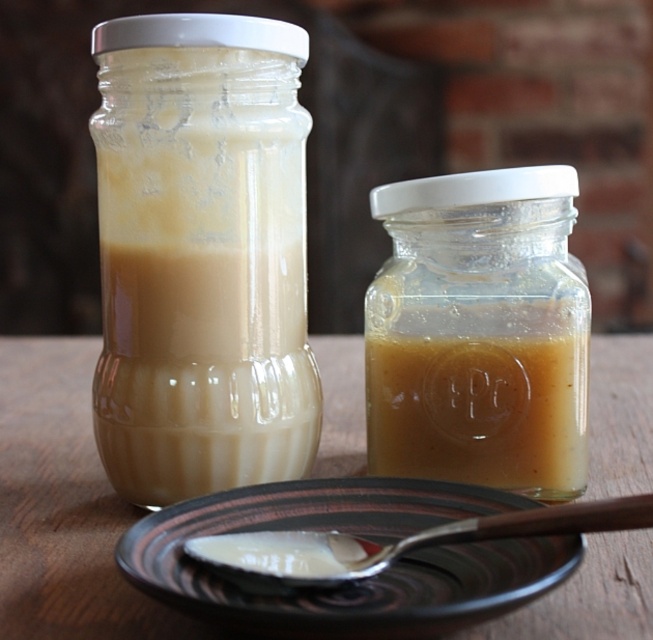
You are a chef preparing a dish and need to place the translucent glass jar at center onto the wooden table at center. Can you safely place it without moving the jar or the table?

The translucent glass jar at center and wooden table at center are 20.48 centimeters apart, so you can safely place the jar on the table without needing to move either since the distance is sufficient for placement.

You are a chef preparing a dish and need to use the silver metallic spoon at lower center to take some of the creamy substance from the translucent glass jar at center. Based on their positions, can you reach the jar with the spoon without moving either object?

The translucent glass jar at center is to the right of the silver metallic spoon at lower center, so yes, the spoon can reach the jar as they are positioned next to each other on the wooden surface.

You are looking at the scene and want to touch the point at coordinates (479, 332). Which object will your finger actually touch?

Your finger will touch the translucent glass jar at center because the point (479, 332) is located on it.